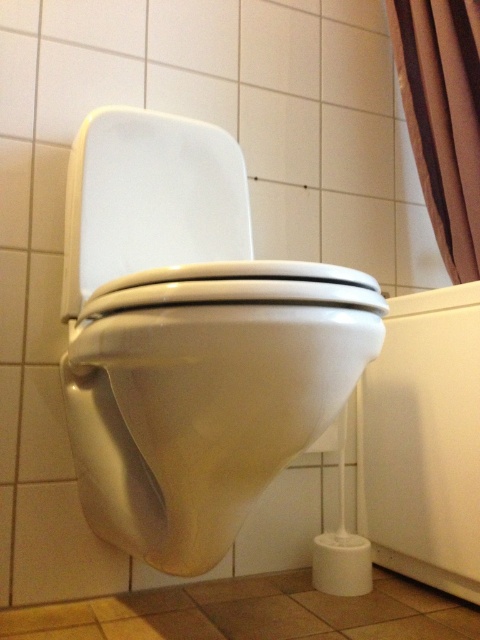
You are a bathroom cleaner and need to clean both the white glossy toilet bowl at center and the white glossy toilet seat at center. Which one should you clean first if you want to start from the leftmost object?

The white glossy toilet seat at center is on the left, so you should clean it first.

You are a bathroom designer planning to install a new showerhead. The showerhead needs to be placed above the white glossy toilet bowl at center. However, there is a brown fabric curtain at upper right in the way. Can the showerhead be installed in that location?

The white glossy toilet bowl at center is positioned under the brown fabric curtain at upper right, so installing the showerhead above the toilet would place it behind the curtain. Therefore, the showerhead cannot be installed in that location as the curtain would block access.